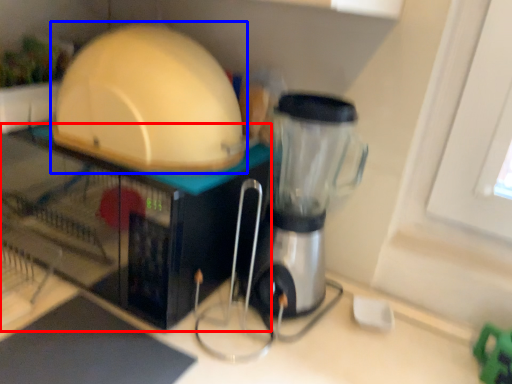
Question: Which object appears closest to the camera in this image, appliance (highlighted by a red box) or appliance (highlighted by a blue box)?

Choices:
 (A) appliance
 (B) appliance

Answer: (B)